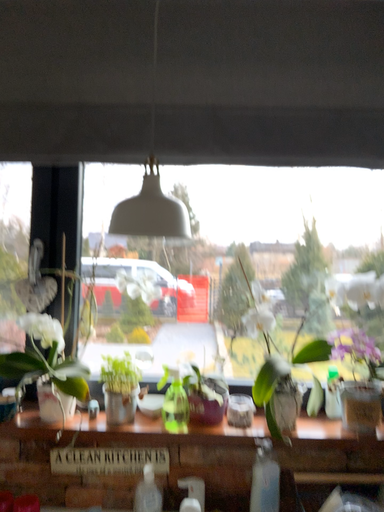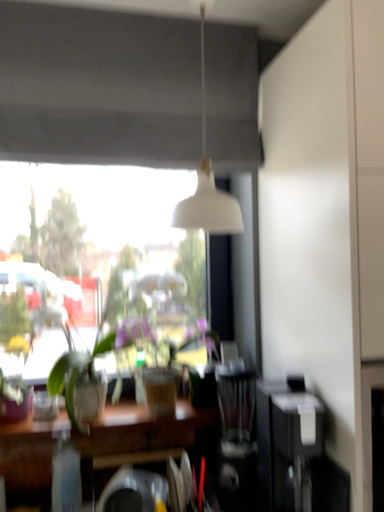
Question: How did the camera likely rotate when shooting the video?

Choices:
 (A) rotated left
 (B) rotated right

Answer: (B)